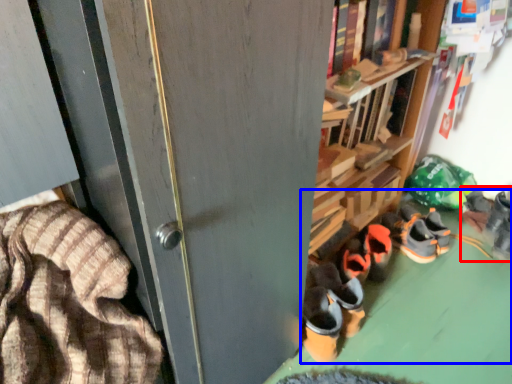
Question: Which of the following is the farthest to the observer, footwear (highlighted by a red box) or footwear (highlighted by a blue box)?

Choices:
 (A) footwear
 (B) footwear

Answer: (A)